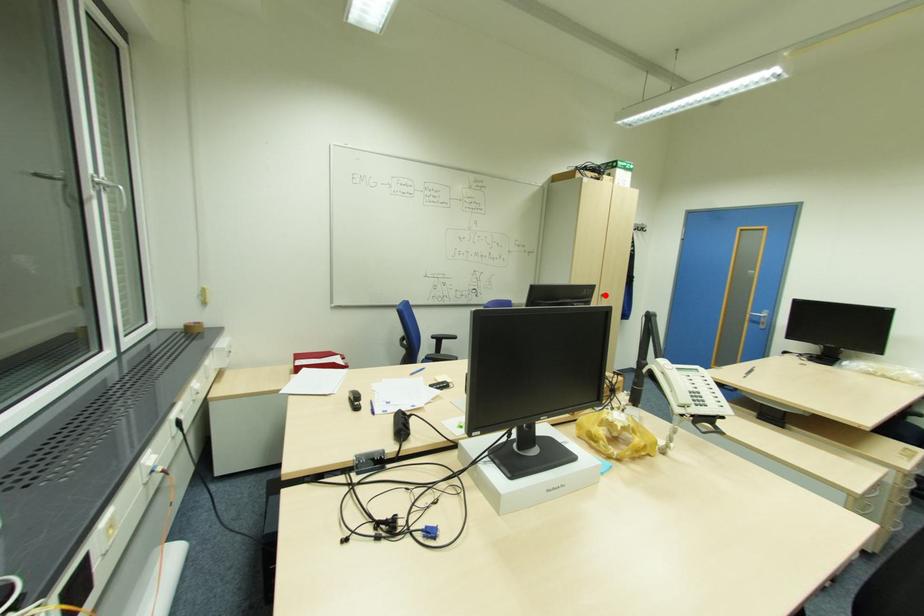
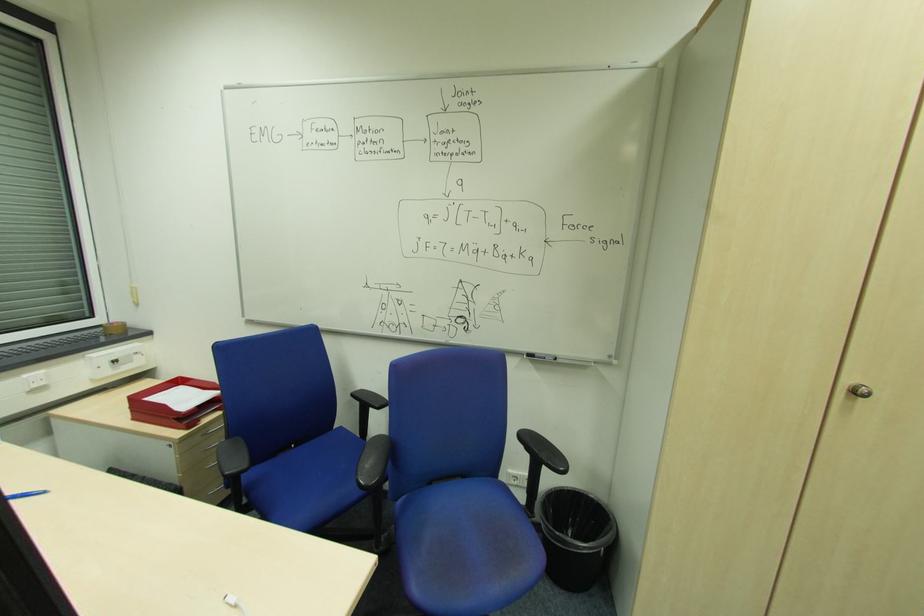
Find the pixel in the second image that matches the highlighted location in the first image.

(860, 392)